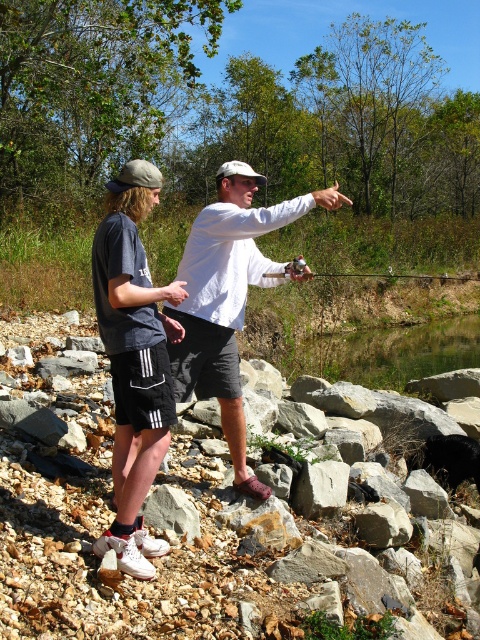
Based on the coordinates provided, which object is located at point (133, 360)?

The point (133, 360) corresponds to the white matte shorts at center.

You are a photographer positioned at the camera. You want to capture a closeup shot of the white matte shorts at center. Considering your current distance, is it feasible to do so without moving closer?

The white matte shorts at center and camera are 9.97 feet apart. To capture a closeup, you would need to either move closer or use a zoom lens capable of focusing at that distance.